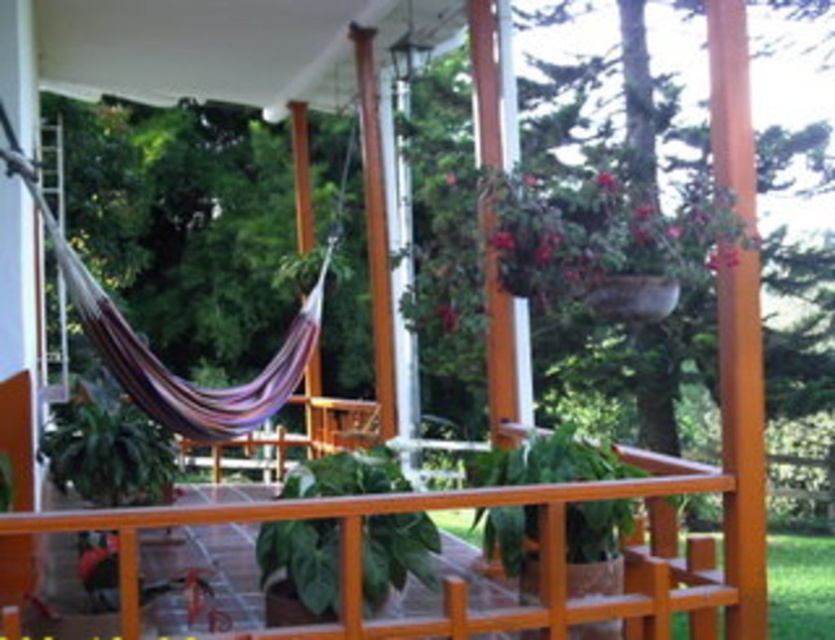
You are planning to place a new bench between the green matte leafy plant at center and the green leafy plant at center. The bench requires 8 feet of space. Is there enough space between them to accommodate the bench?

The distance between the green matte leafy plant at center and the green leafy plant at center is 8.19 feet, which is more than the required 8 feet, so there is enough space to place the bench.

You are designing a layout for a porch and want to place the green matte leafy plant at center and the green leafy plant at center. Which plant should you place closer to the edge of the porch to ensure they don

The green matte leafy plant at center is narrower than the green leafy plant at center, so placing the narrower one closer to the edge would ensure both fit within the porch space.

You are standing on the porch and want to place a new potted plant exactly at the center of the porch. There is already a green matte leafy plant at center. Can you place the new plant in the center without overlapping it?

The green matte leafy plant at center is already positioned at the center of the porch, so placing another plant there would cause overlap. Choose a different spot for the new plant.